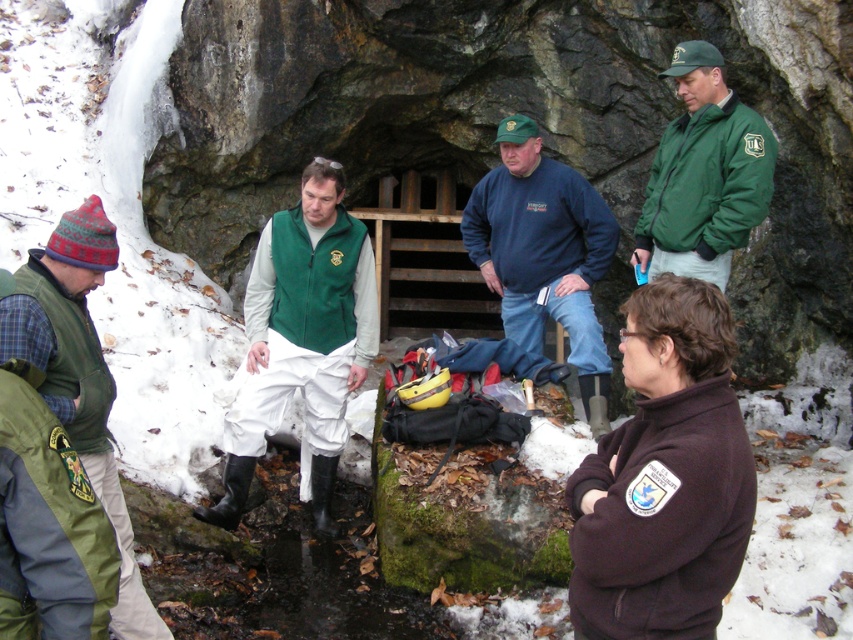
You are standing at the point marked by the coordinates point (608, 230). The cave entrance is 6.28 meters away from you. If you walk straight towards the cave entrance, will you encounter any obstacles? Please explain your reasoning based on the scene description.

The scene description mentions snow covering parts of the ground and rugged rocks framing the cave entrance. Since you are 6.28 meters away from the cave entrance at point (608, 230), there might be obstacles like snowdrifts or rocks along the path. However, the exact presence of obstacles isn,t specified in the provided information. The answer can,t be confirmed definitively with the given details.

You are a photographer standing in front of the cave entrance. You want to take a photo that includes both the blue fleece jacket at center and the green fleece vest at left. Which one of these two items should you adjust your camera angle to focus on first if you want to ensure both are in the frame?

The blue fleece jacket at center is above the green fleece vest at left, so you should focus on the blue fleece jacket at center first to ensure both are in the frame.

You are part of the group near the cave entrance. You need to locate the blue fleece jacket at center and the green fleece vest at left. Which one is positioned to the right side of the other?

The blue fleece jacket at center is positioned to the right of the green fleece vest at left.